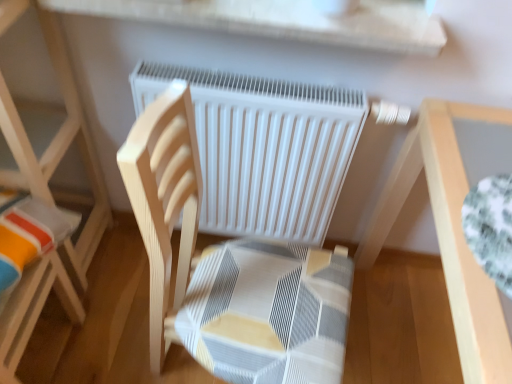
Question: Is light wood table at right positioned with its back to white matte radiator at center?

Choices:
 (A) yes
 (B) no

Answer: (B)

Question: Is light wood table at right positioned in front of white matte radiator at center?

Choices:
 (A) yes
 (B) no

Answer: (A)

Question: Is light wood table at right further to the viewer compared to white matte radiator at center?

Choices:
 (A) yes
 (B) no

Answer: (B)

Question: From the image's perspective, is light wood table at right over white matte radiator at center?

Choices:
 (A) no
 (B) yes

Answer: (A)

Question: Does light wood table at right have a larger size compared to white matte radiator at center?

Choices:
 (A) yes
 (B) no

Answer: (A)

Question: From the image's perspective, relative to white matte radiator at center, is light wood chair at left above or below?

Choices:
 (A) above
 (B) below

Answer: (A)

Question: From a real-world perspective, is light wood chair at left physically located above or below white matte radiator at center?

Choices:
 (A) below
 (B) above

Answer: (B)

Question: Looking at their shapes, would you say light wood chair at left is wider or thinner than white matte radiator at center?

Choices:
 (A) wide
 (B) thin

Answer: (A)

Question: Choose the correct answer: Is light wood chair at left inside white matte radiator at center or outside it?

Choices:
 (A) inside
 (B) outside

Answer: (B)

Question: In terms of height, does wooden chair at center look taller or shorter compared to light wood chair at left?

Choices:
 (A) short
 (B) tall

Answer: (A)

Question: In the image, is wooden chair at center positioned in front of or behind light wood chair at left?

Choices:
 (A) behind
 (B) front

Answer: (B)

Question: Is wooden chair at center inside or outside of light wood chair at left?

Choices:
 (A) inside
 (B) outside

Answer: (B)

Question: In terms of size, does wooden chair at center appear bigger or smaller than light wood chair at left?

Choices:
 (A) small
 (B) big

Answer: (B)

Question: From the image's perspective, is light wood chair at left positioned above or below wooden chair at center?

Choices:
 (A) above
 (B) below

Answer: (A)

Question: In the image, is light wood chair at left positioned in front of or behind wooden chair at center?

Choices:
 (A) front
 (B) behind

Answer: (B)